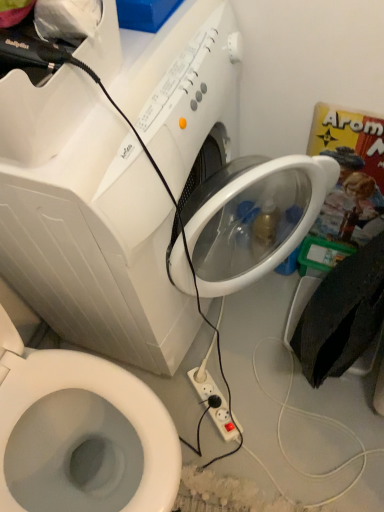
Question: Is white plastic washing machine at upper center touching white plastic power plugs and sockets at lower center?

Choices:
 (A) no
 (B) yes

Answer: (A)

Question: Is white plastic washing machine at upper center in front of white plastic power plugs and sockets at lower center?

Choices:
 (A) no
 (B) yes

Answer: (B)

Question: Can you confirm if white plastic washing machine at upper center is positioned to the right of white plastic power plugs and sockets at lower center?

Choices:
 (A) no
 (B) yes

Answer: (A)

Question: Considering the relative sizes of white plastic washing machine at upper center and white plastic power plugs and sockets at lower center in the image provided, is white plastic washing machine at upper center shorter than white plastic power plugs and sockets at lower center?

Choices:
 (A) yes
 (B) no

Answer: (B)

Question: Is white plastic washing machine at upper center further to camera compared to white plastic power plugs and sockets at lower center?

Choices:
 (A) yes
 (B) no

Answer: (B)

Question: From the image's perspective, does white plastic washing machine at upper center appear lower than white plastic power plugs and sockets at lower center?

Choices:
 (A) yes
 (B) no

Answer: (B)

Question: From the image's perspective, does white plastic power plugs and sockets at lower center appear lower than white plastic washing machine at upper center?

Choices:
 (A) no
 (B) yes

Answer: (B)

Question: Is white plastic power plugs and sockets at lower center thinner than white plastic washing machine at upper center?

Choices:
 (A) yes
 (B) no

Answer: (A)

Question: Is white plastic power plugs and sockets at lower center directly adjacent to white plastic washing machine at upper center?

Choices:
 (A) no
 (B) yes

Answer: (A)

Question: Are white plastic power plugs and sockets at lower center and white plastic washing machine at upper center far apart?

Choices:
 (A) yes
 (B) no

Answer: (B)

Question: Is white plastic power plugs and sockets at lower center at the left side of white plastic washing machine at upper center?

Choices:
 (A) no
 (B) yes

Answer: (A)

Question: Considering the relative sizes of white plastic power plugs and sockets at lower center and white plastic washing machine at upper center in the image provided, is white plastic power plugs and sockets at lower center wider than white plastic washing machine at upper center?

Choices:
 (A) no
 (B) yes

Answer: (A)

Question: Is white plastic power plugs and sockets at lower center looking in the opposite direction of white plastic bidet at lower left?

Choices:
 (A) yes
 (B) no

Answer: (B)